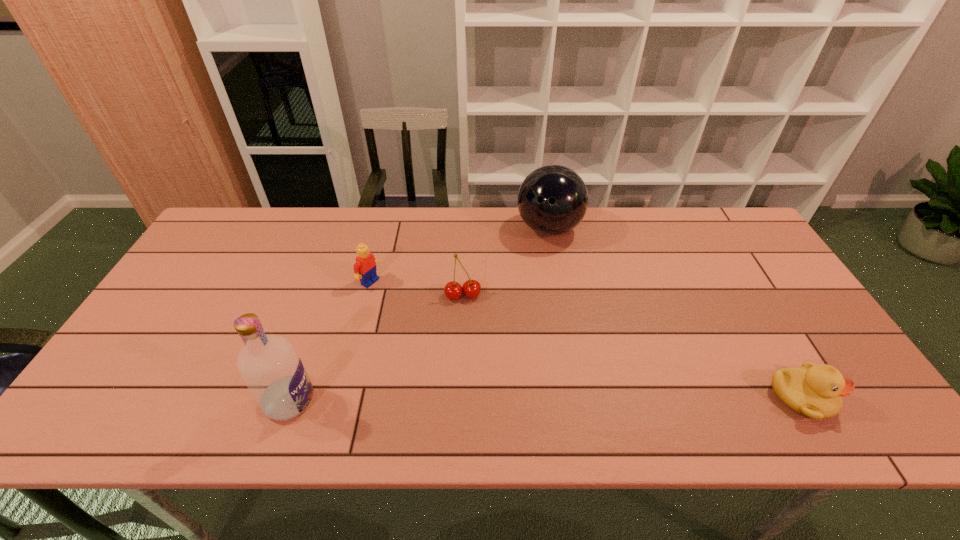
This screenshot has height=540, width=960. Find the location of `vacant space situated 0.100m with the stems of the cherry pointing upwards`. vacant space situated 0.100m with the stems of the cherry pointing upwards is located at coordinates (470, 331).

The image size is (960, 540). Identify the location of free space located 0.070m with the stems of the cherry pointing upwards. (469, 322).

Find the location of `vacant region located 0.400m on the side of the bowling ball with the finger holes`. vacant region located 0.400m on the side of the bowling ball with the finger holes is located at coordinates (528, 351).

In order to click on free space located 0.290m on the side of the bowling ball with the finger holes in this screenshot , I will do `click(534, 318)`.

Where is `vacant space located 0.360m on the side of the bowling ball with the finger holes`? The height and width of the screenshot is (540, 960). vacant space located 0.360m on the side of the bowling ball with the finger holes is located at coordinates pos(531,339).

Identify the location of free location located on the face of the Lego. (396, 298).

Image resolution: width=960 pixels, height=540 pixels. Identify the location of vacant space positioned 0.170m on the face of the Lego. pyautogui.click(x=422, y=313).

Find the location of a particular element. Image resolution: width=960 pixels, height=540 pixels. vacant area situated 0.330m on the face of the Lego is located at coordinates (469, 341).

This screenshot has width=960, height=540. What are the coordinates of `object at the far edge` in the screenshot? It's located at (552, 200).

Locate an element on the screen. The width and height of the screenshot is (960, 540). vodka that is at the near edge is located at coordinates (271, 368).